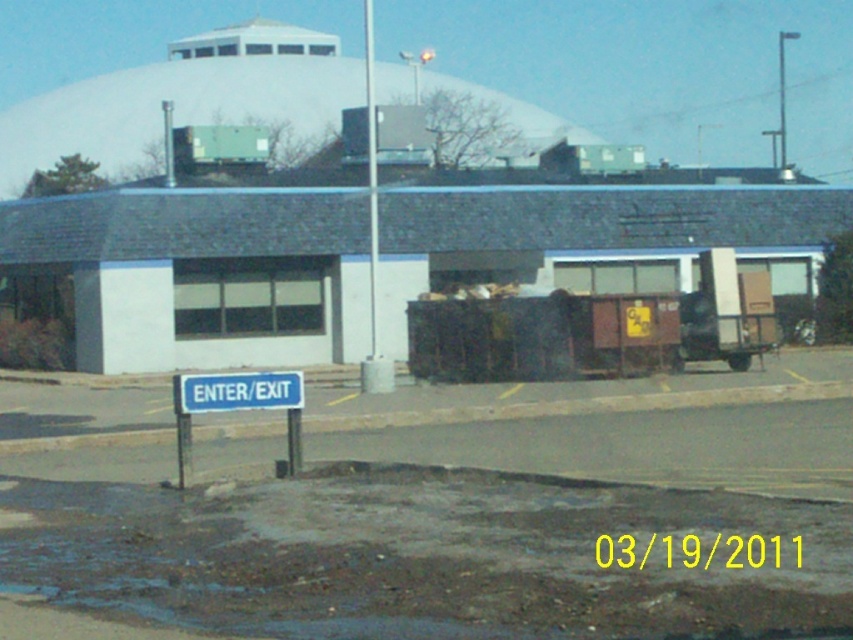
Question: Is white matte dome at upper center thinner than blue plastic sign at lower left?

Choices:
 (A) no
 (B) yes

Answer: (A)

Question: Estimate the real-world distances between objects in this image. Which object is closer to the metallic pole at upper center?

Choices:
 (A) white matte dome at upper center
 (B) blue plastic sign at lower left

Answer: (A)

Question: Does metallic pole at center come in front of metallic pole at upper center?

Choices:
 (A) yes
 (B) no

Answer: (A)

Question: From the image, what is the correct spatial relationship of white matte dome at upper center in relation to metallic pole at center?

Choices:
 (A) left
 (B) right

Answer: (A)

Question: Which of the following is the closest to the observer?

Choices:
 (A) blue plastic sign at lower left
 (B) metallic pole at upper center
 (C) metallic pole at center
 (D) white matte dome at upper center

Answer: (A)

Question: Estimate the real-world distances between objects in this image. Which object is farther from the white matte dome at upper center?

Choices:
 (A) metallic pole at center
 (B) blue plastic sign at center

Answer: (B)